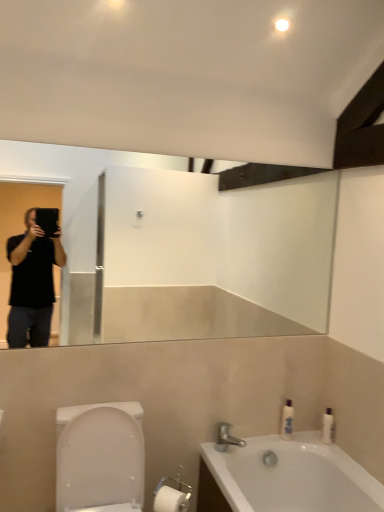
Question: Considering the positions of silver metallic faucet at lower center and white glossy bathtub at lower right in the image, is silver metallic faucet at lower center wider or thinner than white glossy bathtub at lower right?

Choices:
 (A) thin
 (B) wide

Answer: (A)

Question: Based on their positions, is silver metallic faucet at lower center located to the left or right of white glossy bathtub at lower right?

Choices:
 (A) right
 (B) left

Answer: (B)

Question: Which object is positioned closest to the white glossy bottle at right, the 1th toiletry when ordered from right to left?

Choices:
 (A) white glossy bathtub at lower right
 (B) silver metallic faucet at lower center
 (C) white glossy bottle at right, arranged as the 2th toiletry when viewed from the right
 (D) white glossy toilet at lower left

Answer: (C)

Question: Estimate the real-world distances between objects in this image. Which object is farther from the white glossy bottle at right, which is counted as the first toiletry, starting from the left?

Choices:
 (A) silver metallic faucet at lower center
 (B) white glossy bottle at right, arranged as the second toiletry when viewed from the left
 (C) white glossy bathtub at lower right
 (D) white glossy toilet at lower left

Answer: (D)